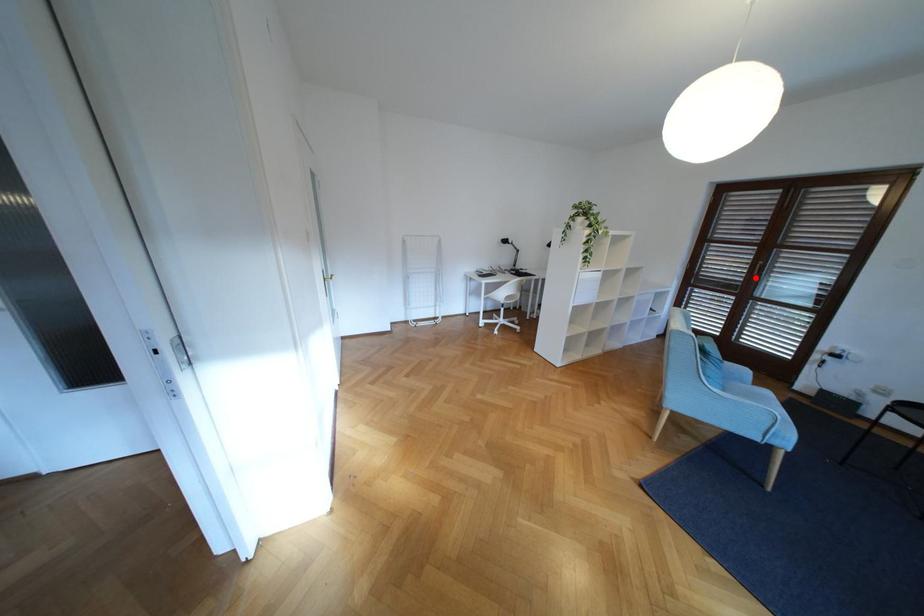
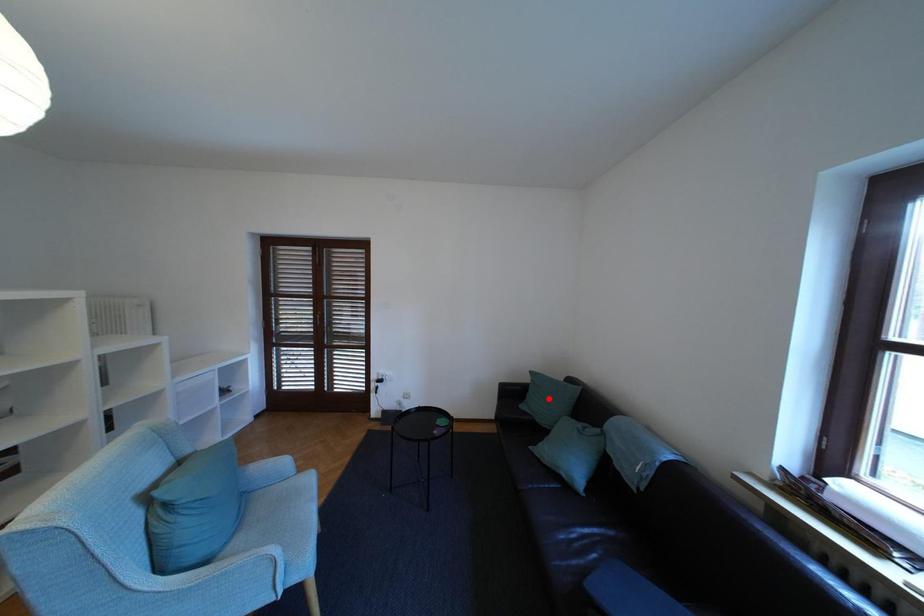
I am providing you with two images of the same scene from different viewpoints. A red point is marked on the first image and another point is marked on the second image. Is the red point in image1 aligned with the point shown in image2?

No